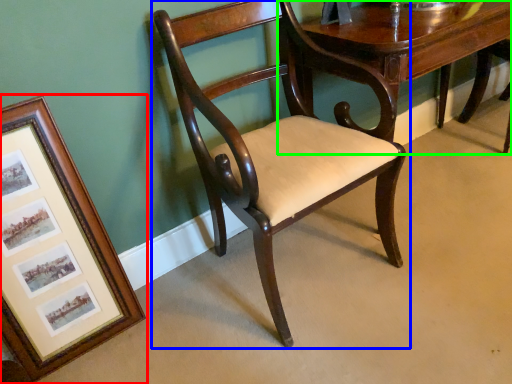
Question: Considering the real-world distances, which object is farthest from picture frame (highlighted by a red box)? chair (highlighted by a blue box) or table (highlighted by a green box)?

Choices:
 (A) chair
 (B) table

Answer: (B)